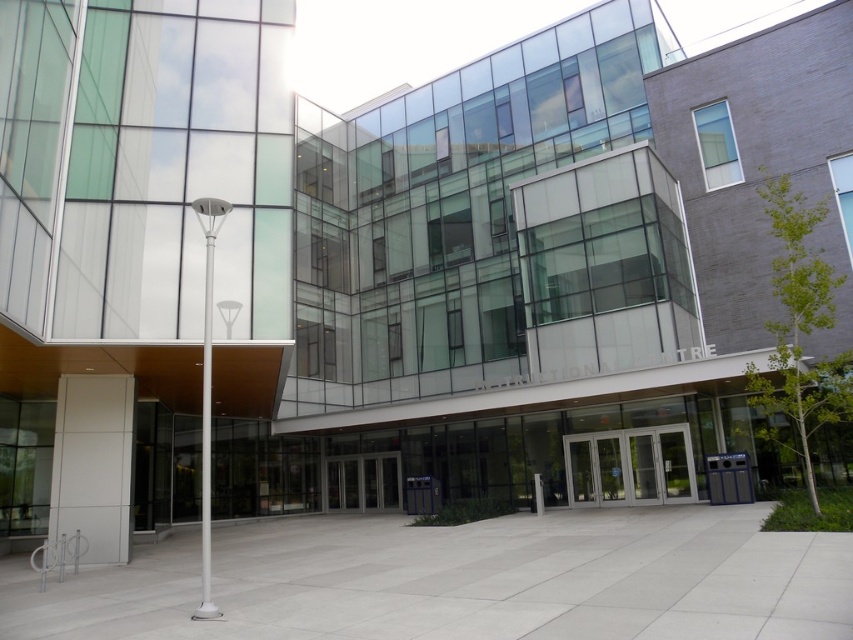
Based on the photo, is silver metallic doors at center positioned in front of metallic glass doors at center?

Yes.

Is point (682, 445) less distant than point (334, 486)?

Yes.

This screenshot has width=853, height=640. Describe the element at coordinates (630, 467) in the screenshot. I see `silver metallic doors at center` at that location.

Where is `silver metallic doors at center`? This screenshot has width=853, height=640. silver metallic doors at center is located at coordinates (630, 467).